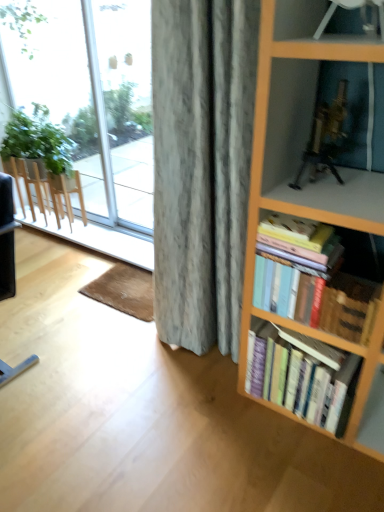
Where is `vacant space to the right of black leather chair at lower left`? This screenshot has width=384, height=512. vacant space to the right of black leather chair at lower left is located at coordinates (71, 347).